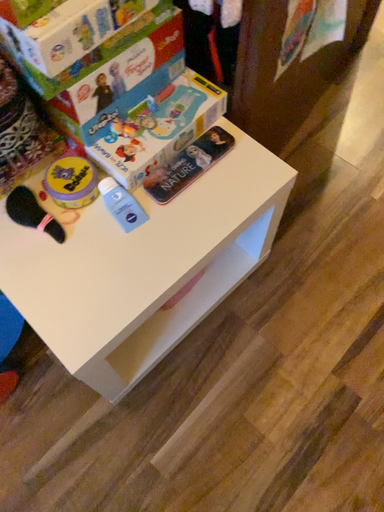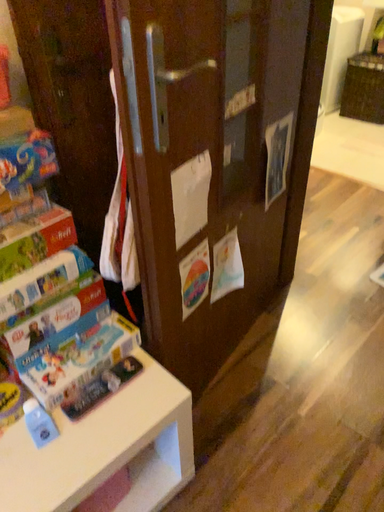
Question: Which way did the camera rotate in the video?

Choices:
 (A) rotated upward
 (B) rotated downward

Answer: (A)